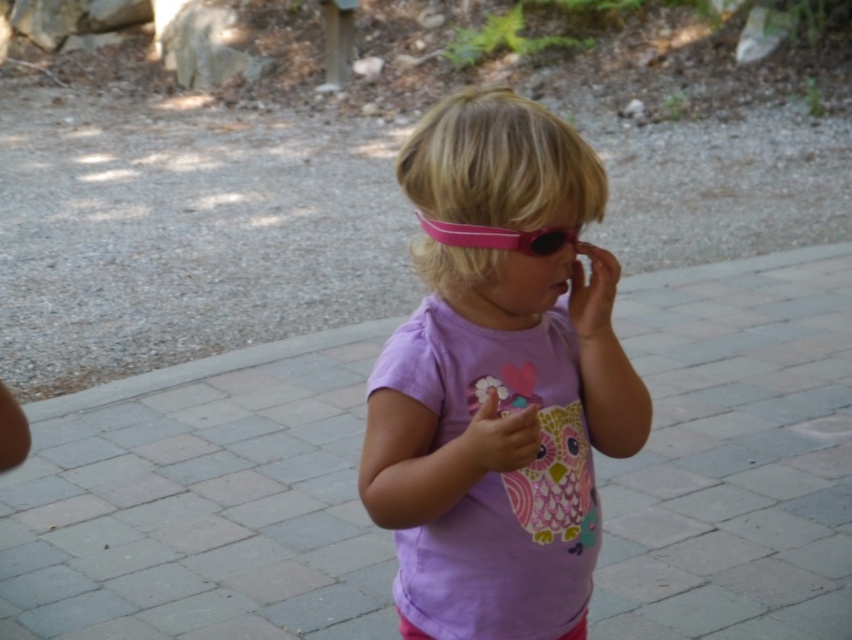
Question: Can you confirm if gray brick pavement at center is thinner than pink rubber goggles at center?

Choices:
 (A) no
 (B) yes

Answer: (A)

Question: Which object appears closest to the camera in this image?

Choices:
 (A) pink rubber goggles at center
 (B) purple matte shirt at center

Answer: (B)

Question: Based on their relative distances, which object is nearer to the purple matte shirt at center?

Choices:
 (A) gray brick pavement at center
 (B) pink rubber goggles at center

Answer: (B)

Question: Which point is closer to the camera taking this photo?

Choices:
 (A) (810, 419)
 (B) (452, 396)

Answer: (B)

Question: Is gray brick pavement at center further to camera compared to purple matte shirt at center?

Choices:
 (A) no
 (B) yes

Answer: (B)

Question: Is purple matte shirt at center smaller than pink rubber goggles at center?

Choices:
 (A) no
 (B) yes

Answer: (A)